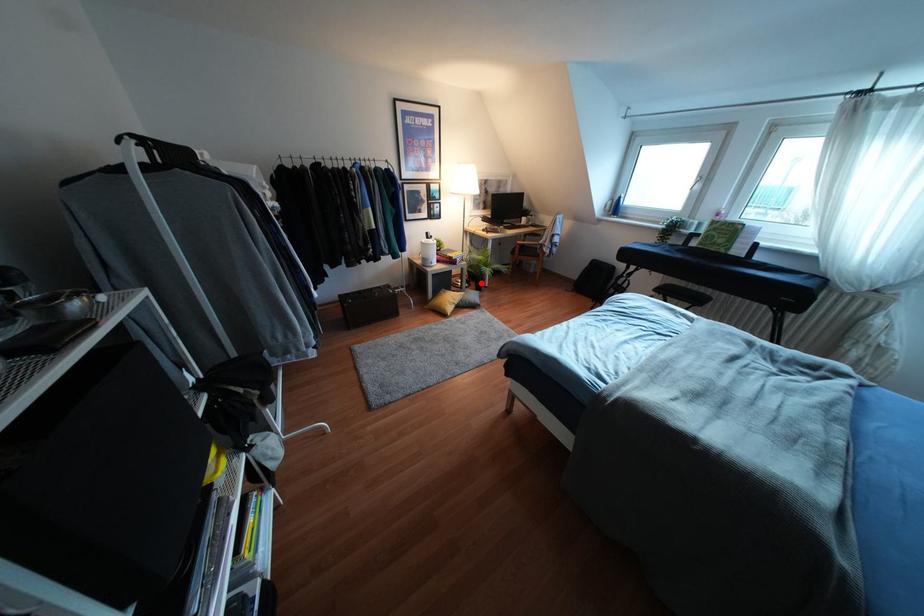
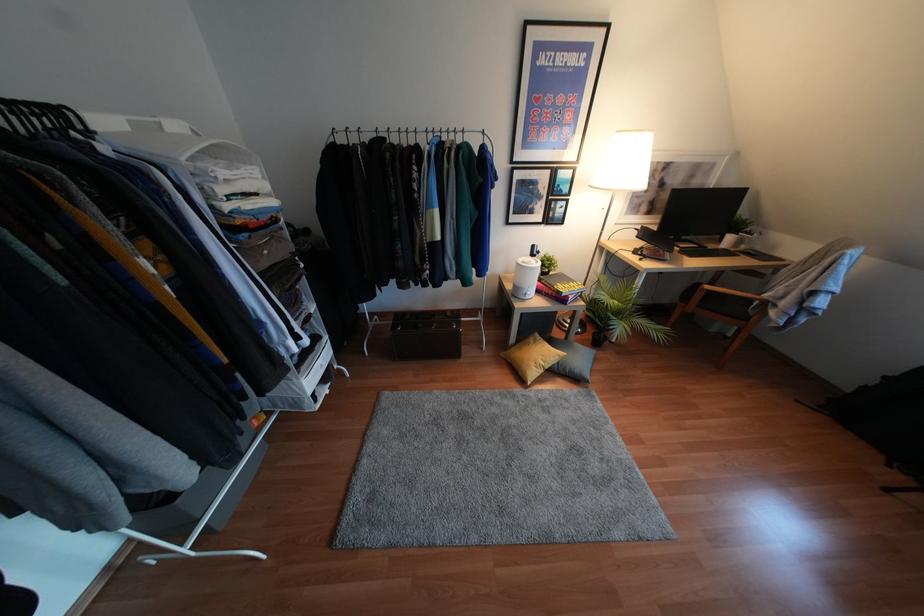
In the second image, find the point that corresponds to the highlighted location in the first image.

(604, 336)